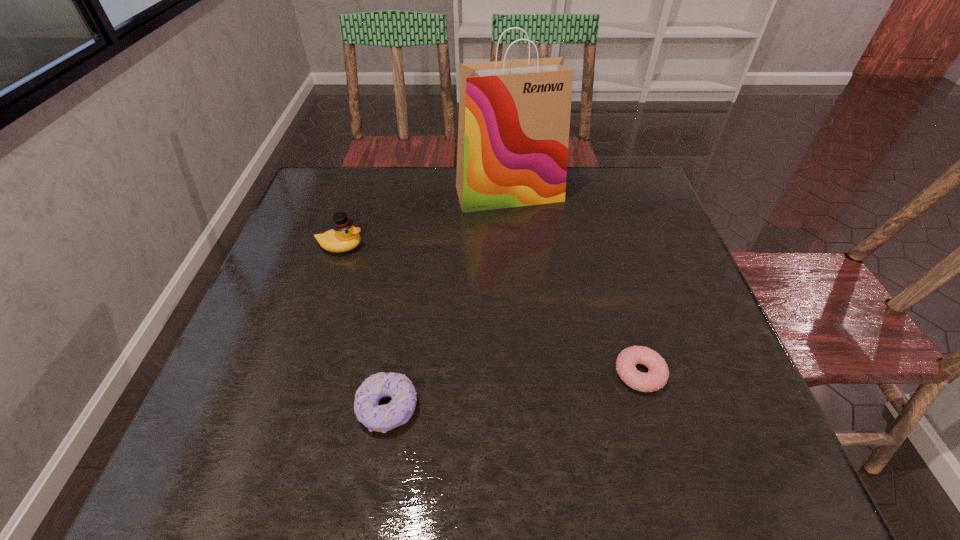
Find the location of `vacant region at the far right corner of the desktop`. vacant region at the far right corner of the desktop is located at coordinates (612, 188).

Locate an element on the screen. The image size is (960, 540). vacant space at the near right corner is located at coordinates (723, 450).

You are a GUI agent. You are given a task and a screenshot of the screen. Output one action in this format:
    pyautogui.click(x=<x>, y=<y>)
    Task: Click on the unoccupied position between the second shortest object and the third shortest object
    
    Given the screenshot: What is the action you would take?
    pyautogui.click(x=365, y=327)

Locate an element on the screen. unoccupied area between the duck and the right doughnut is located at coordinates [491, 310].

You are a GUI agent. You are given a task and a screenshot of the screen. Output one action in this format:
    pyautogui.click(x=<x>, y=<y>)
    Task: Click on the free point between the taller doughnut and the third object from left to right
    This screenshot has width=960, height=540.
    Given the screenshot: What is the action you would take?
    pyautogui.click(x=448, y=301)

In order to click on vacant region between the left doughnut and the duck in this screenshot , I will do `click(365, 327)`.

I want to click on vacant area between the second farthest object and the taller doughnut, so click(365, 327).

What are the coordinates of `vacant space in between the left doughnut and the third object from left to right` in the screenshot? It's located at (448, 301).

The image size is (960, 540). I want to click on free space between the shopping bag and the shorter doughnut, so click(x=574, y=284).

At what (x,y) coordinates should I click in order to perform the action: click on free space between the farthest object and the taller doughnut. Please return your answer as a coordinate pair (x, y). Looking at the image, I should click on (448, 301).